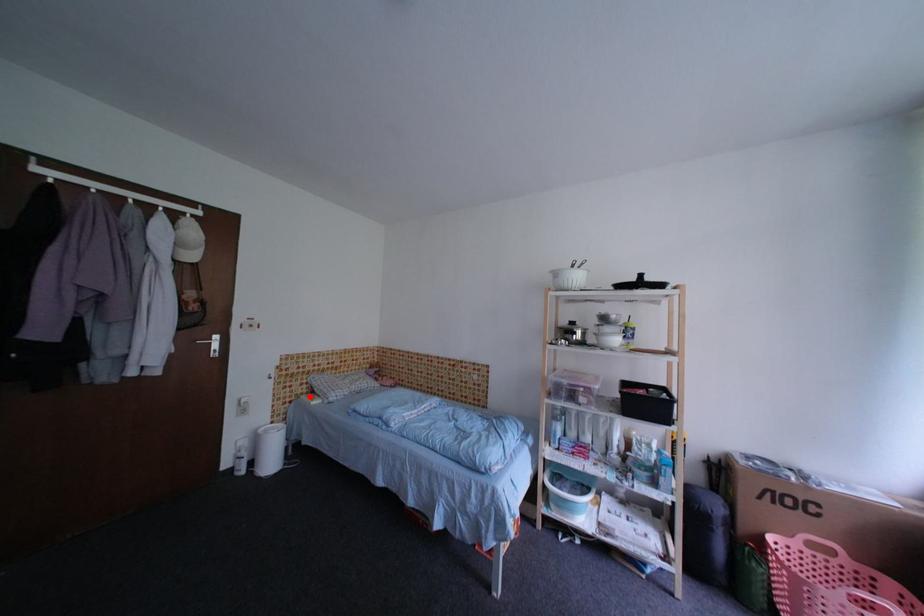
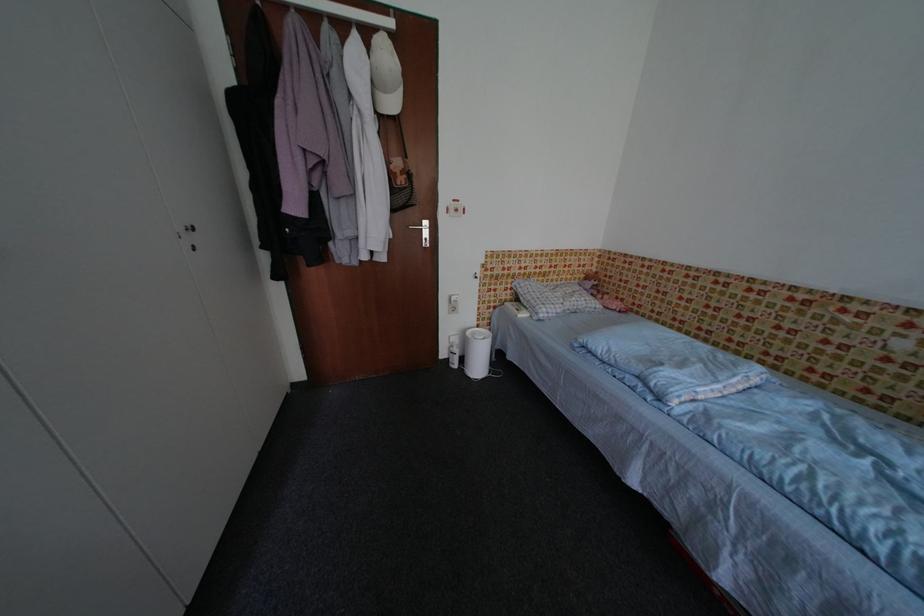
Question: I am providing you with two images of the same scene from different viewpoints. In image1, a red point is highlighted. Considering the same 3D point in image2, which of the following is correct?

Choices:
 (A) It is closer
 (B) It is farther

Answer: (A)